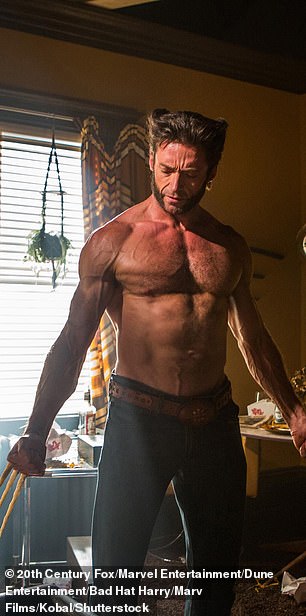
The width and height of the screenshot is (306, 616). I want to click on window, so [26, 306].